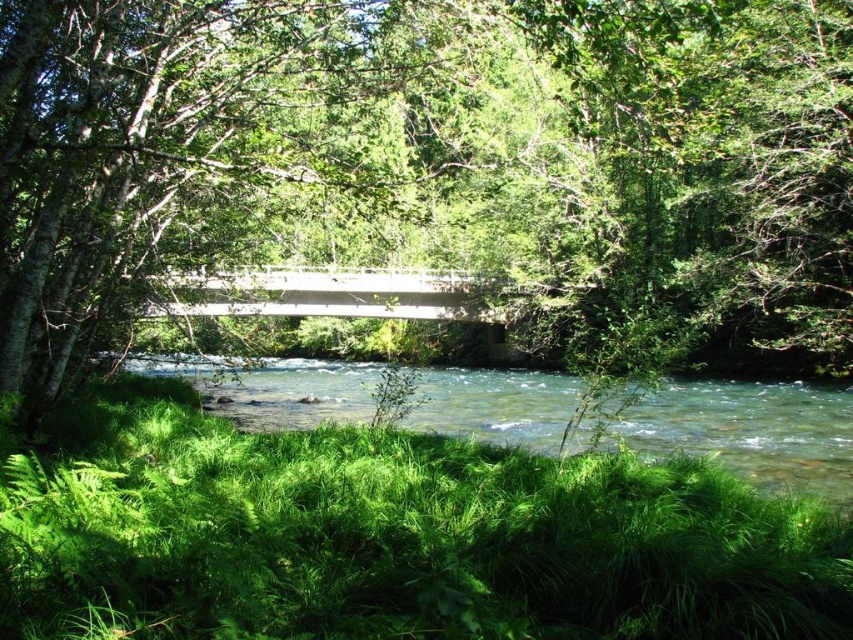
You are a hiker who wants to take a photo of the green leafy grass at lower center without the green leafy tree at center blocking the view. Can you move to a position where the tree is out of frame?

The green leafy tree at center is positioned over green leafy grass at lower center, so you can move to a position behind the grass to take the photo without the tree blocking the view.

You are standing at the point marked by coordinates point (x=432, y=177) in the image. What object are you directly facing?

You are directly facing the green leafy tree at center as indicated by the coordinates point (x=432, y=177).

You are standing at the point marked as point (390, 538) in the image. What do you see around you?

You are standing in the green leafy grass at lower center, which is part of the dense patch of grass and ferns in the foreground of the serene natural scene.